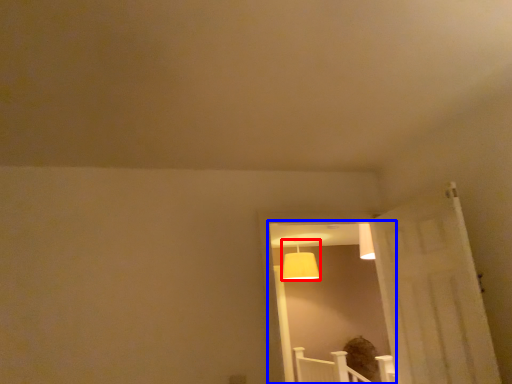
Question: Which of the following is the farthest to the observer, lamp (highlighted by a red box) or window (highlighted by a blue box)?

Choices:
 (A) lamp
 (B) window

Answer: (A)